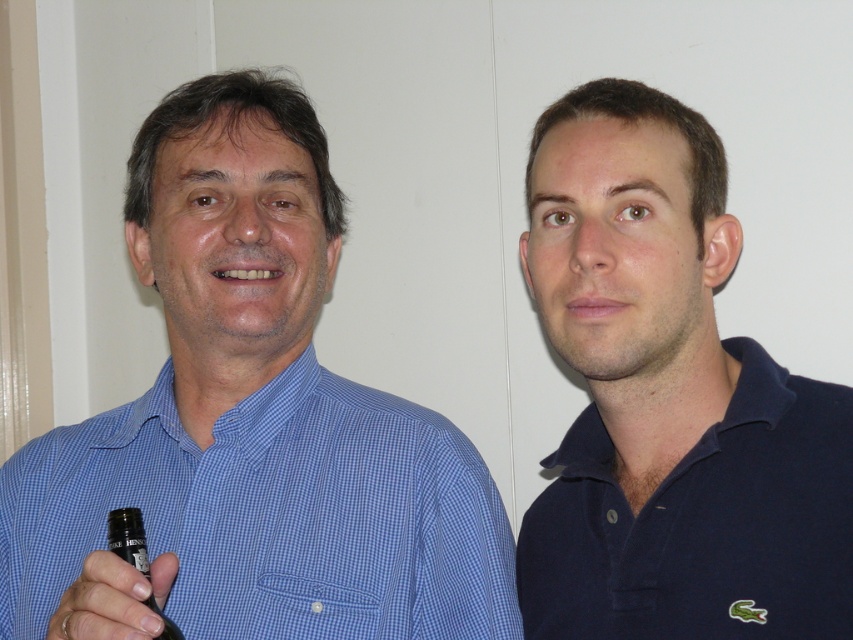
Question: Does navy blue polo shirt at right have a lesser width compared to dark glass bottle at lower left?

Choices:
 (A) no
 (B) yes

Answer: (A)

Question: Which point is closer to the camera?

Choices:
 (A) blue checkered shirt at left
 (B) matte black bottle at lower left

Answer: (B)

Question: Is navy blue polo shirt at right further to camera compared to matte black bottle at lower left?

Choices:
 (A) no
 (B) yes

Answer: (B)

Question: Which point appears farthest from the camera in this image?

Choices:
 (A) 126,538
 (B) 271,192
 (C) 88,563

Answer: (B)

Question: Can you confirm if matte black bottle at lower left is smaller than dark glass bottle at lower left?

Choices:
 (A) no
 (B) yes

Answer: (A)

Question: Estimate the real-world distances between objects in this image. Which object is closer to the navy blue polo shirt at right?

Choices:
 (A) blue checkered shirt at left
 (B) matte black bottle at lower left

Answer: (A)